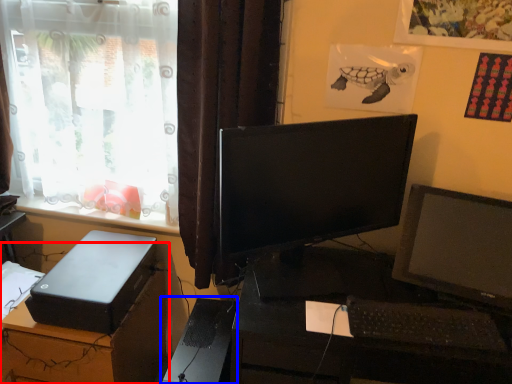
Question: Among these objects, which one is nearest to the camera, desk (highlighted by a red box) or computer tower (highlighted by a blue box)?

Choices:
 (A) desk
 (B) computer tower

Answer: (B)